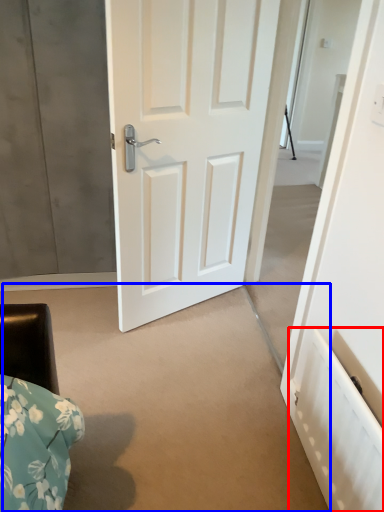
Question: Which object appears closest to the camera in this image, radiator (highlighted by a red box) or concrete (highlighted by a blue box)?

Choices:
 (A) radiator
 (B) concrete

Answer: (A)